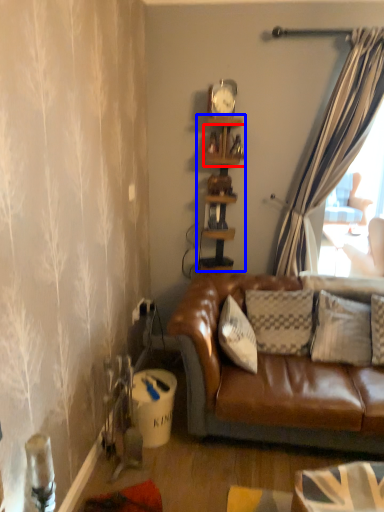
Question: Which object appears closest to the camera in this image, shelf (highlighted by a red box) or shelf (highlighted by a blue box)?

Choices:
 (A) shelf
 (B) shelf

Answer: (B)